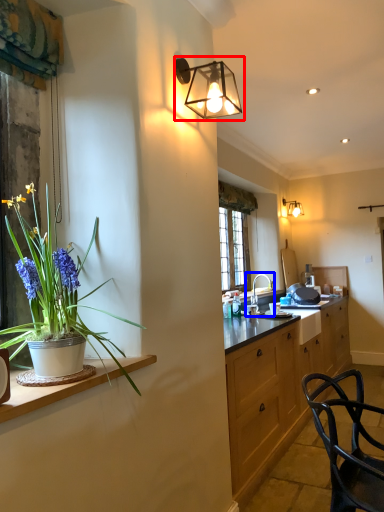
Question: Which point is closer to the camera, lamp (highlighted by a red box) or sink (highlighted by a blue box)?

Choices:
 (A) lamp
 (B) sink

Answer: (A)